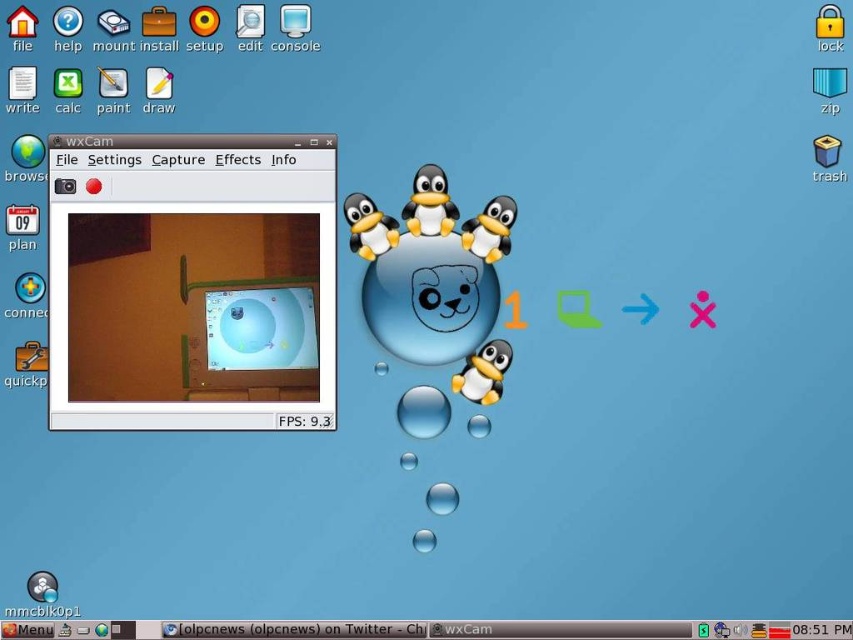
Question: Does matte plastic penguin at center come in front of transparent glass bubble at center?

Choices:
 (A) yes
 (B) no

Answer: (A)

Question: Can you confirm if matte black penguin at upper center is positioned below transparent glass bubble at center?

Choices:
 (A) no
 (B) yes

Answer: (A)

Question: Which point appears closest to the camera in this image?

Choices:
 (A) (345, 216)
 (B) (294, 381)
 (C) (477, 246)
 (D) (448, 410)

Answer: (A)

Question: Among these points, which one is nearest to the camera?

Choices:
 (A) (506, 250)
 (B) (200, 349)
 (C) (357, 193)
 (D) (480, 364)

Answer: (B)

Question: Among these objects, which one is farthest from the camera?

Choices:
 (A) matte plastic penguin at center
 (B) white matte penguin at upper center

Answer: (A)

Question: Can you confirm if matte black penguin at lower center is positioned to the left of white matte penguin at upper center?

Choices:
 (A) yes
 (B) no

Answer: (B)